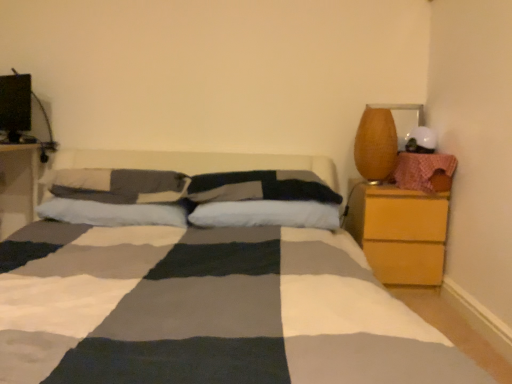
Question: Relative to white cotton pillow at center, positioned as the fourth pillow in right-to-left order, is white soft pillow at center, which is the 1th pillow in right-to-left order, in front or behind?

Choices:
 (A) front
 (B) behind

Answer: (A)

Question: Is white soft pillow at center, which is the 1th pillow in right-to-left order, inside the boundaries of white cotton pillow at center, the 1th pillow when ordered from left to right, or outside?

Choices:
 (A) outside
 (B) inside

Answer: (A)

Question: Which of these objects is positioned closest to the wooden nightstand at left, the 1th nightstand from the left?

Choices:
 (A) white cotton pillow at center, the 1th pillow when ordered from left to right
 (B) matte brown vase at right
 (C) white soft pillow at center, acting as the second pillow starting from the left
 (D) wooden nightstand at right, the 1th nightstand positioned from the right
 (E) soft cotton pillow at center, acting as the 2th pillow starting from the right

Answer: (A)

Question: Which of these objects is positioned farthest from the white cotton pillow at center, positioned as the fourth pillow in right-to-left order?

Choices:
 (A) wooden nightstand at left, the 1th nightstand from the left
 (B) soft cotton pillow at center, the 3th pillow in the left-to-right sequence
 (C) matte brown vase at right
 (D) wooden nightstand at right, the 2th nightstand positioned from the left
 (E) white soft pillow at center, acting as the second pillow starting from the left

Answer: (D)